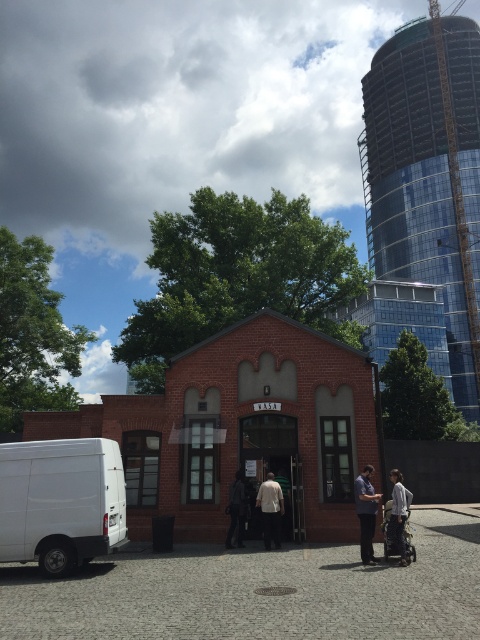
Question: Can you confirm if glassy steel tower at upper right is bigger than light beige fabric shirt at center?

Choices:
 (A) no
 (B) yes

Answer: (B)

Question: Is white matte van at lower left behind dark gray fabric coat at center?

Choices:
 (A) yes
 (B) no

Answer: (B)

Question: Which of the following is the farthest from the observer?

Choices:
 (A) (45, 496)
 (B) (277, 513)

Answer: (B)

Question: Observing the image, what is the correct spatial positioning of white matte van at lower left in reference to blue cotton shirt at center?

Choices:
 (A) right
 (B) left

Answer: (B)

Question: Which point appears farthest from the camera in this image?

Choices:
 (A) (407, 500)
 (B) (226, 508)
 (C) (476, 120)
 (D) (371, 560)

Answer: (C)

Question: Which of these objects is positioned farthest from the dark gray fabric coat at center?

Choices:
 (A) glassy steel tower at upper right
 (B) light beige fabric shirt at center

Answer: (A)